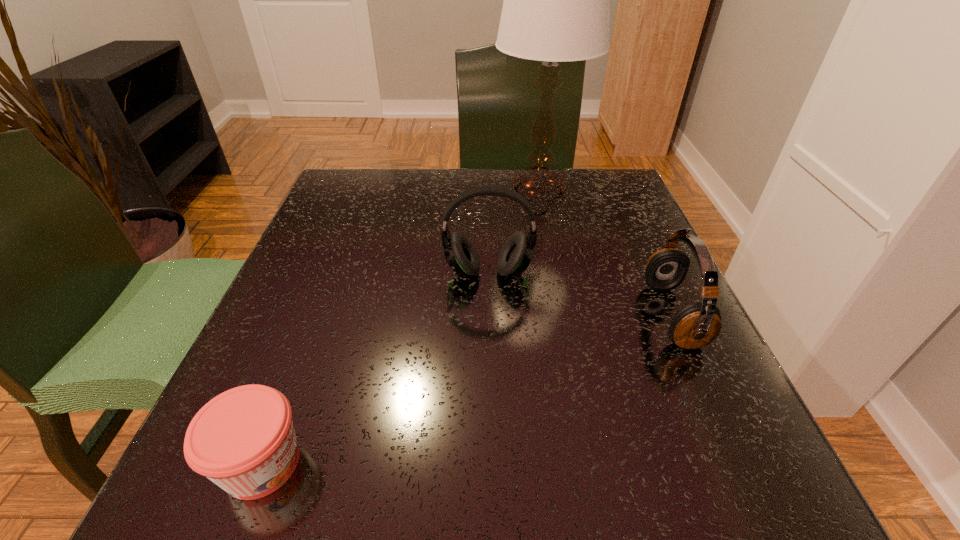
Locate an element on the screen. This screenshot has width=960, height=540. headset that is at the right edge is located at coordinates (696, 325).

Where is `object present at the near left corner`? The image size is (960, 540). object present at the near left corner is located at coordinates (243, 440).

Identify the location of object present at the far right corner. The height and width of the screenshot is (540, 960). (556, 8).

Where is `vacant space at the far edge of the desktop`? The height and width of the screenshot is (540, 960). vacant space at the far edge of the desktop is located at coordinates (467, 214).

Identify the location of free space at the near edge. (378, 476).

The width and height of the screenshot is (960, 540). What are the coordinates of `blank space at the left edge of the desktop` in the screenshot? It's located at (333, 316).

Image resolution: width=960 pixels, height=540 pixels. I want to click on vacant space at the right edge of the desktop, so click(678, 422).

Find the location of `vacant space at the far left corner of the desktop`. vacant space at the far left corner of the desktop is located at coordinates (351, 182).

The width and height of the screenshot is (960, 540). I want to click on blank space at the near left corner of the desktop, so click(272, 510).

Locate an element on the screen. The width and height of the screenshot is (960, 540). vacant space at the far right corner of the desktop is located at coordinates (629, 190).